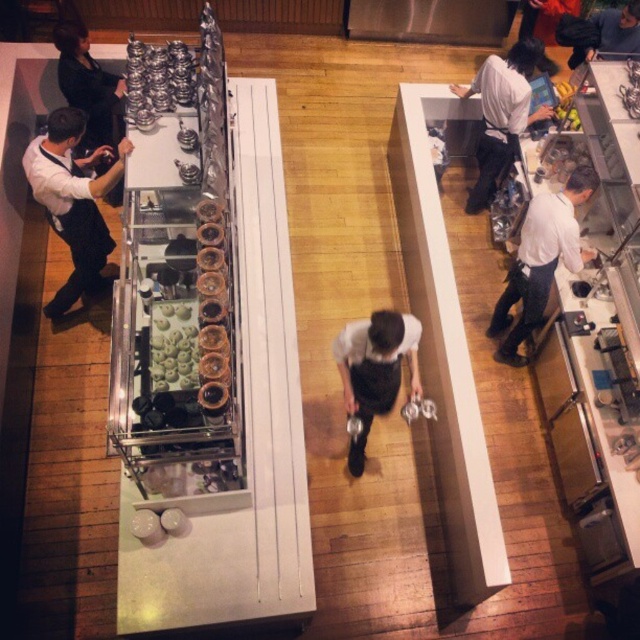
You are a customer looking to place an order at the left island. You see a person wearing a white shirt at left and another wearing a white apron at right. Which staff member is closer to you in height?

The white shirt at left is much taller than the white apron at right, so the staff member in the white shirt at left is taller.